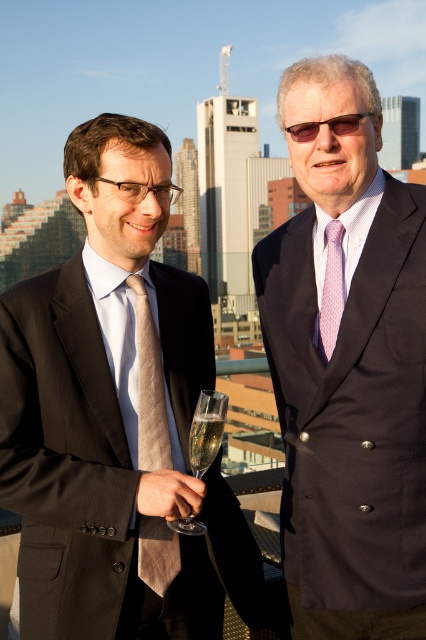
You are a photographer positioned at the edge of the rooftop terrace. You want to take a photo that includes both the matte black suit at center and the pink striped tie at center. Given that your camera has a maximum focus range of 10 meters, will you be able to capture both subjects clearly in the same frame?

The matte black suit at center and pink striped tie at center are 10.25 meters apart from each other. Since the camera can only focus up to 10 meters, the distance between them exceeds the maximum focus range. Therefore, you cannot capture both subjects clearly in the same frame.

You are a photographer positioned at the back of the rooftop terrace. You want to take a photo of the matte black suit at center and the clear glass wine glass at center. Which object will be closer to the camera in the photo?

The matte black suit at center is in front of the clear glass wine glass at center, so it will be closer to the camera in the photo.

Based on the photo, you are a bartender at a rooftop event and need to place two clear glasses on a tray. You have a clear glass wine glass at center and a clear glass at center. According to the scene, which glass should you place on top to ensure stability?

The clear glass wine glass at center should be placed below the clear glass at center to ensure stability since the description states that the clear glass wine glass at center is below clear glass at center in the scene.